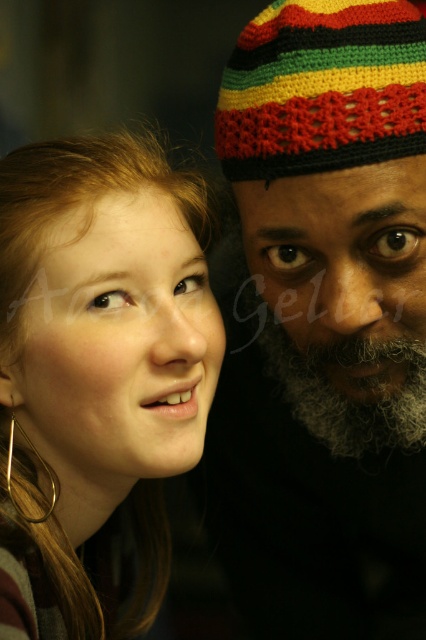
You are a photographer adjusting the focus on your camera. You notice the matte gold hoop earring at left and the gray curly beard at center in your viewfinder. Which object appears wider in the frame?

The matte gold hoop earring at left appears wider than the gray curly beard at center because its width surpasses the gray curly beard at center.

Based on the scene description, where is the knitted multicolored beanie at right located in the image?

The knitted multicolored beanie at right is located at point [324,323] in the image.